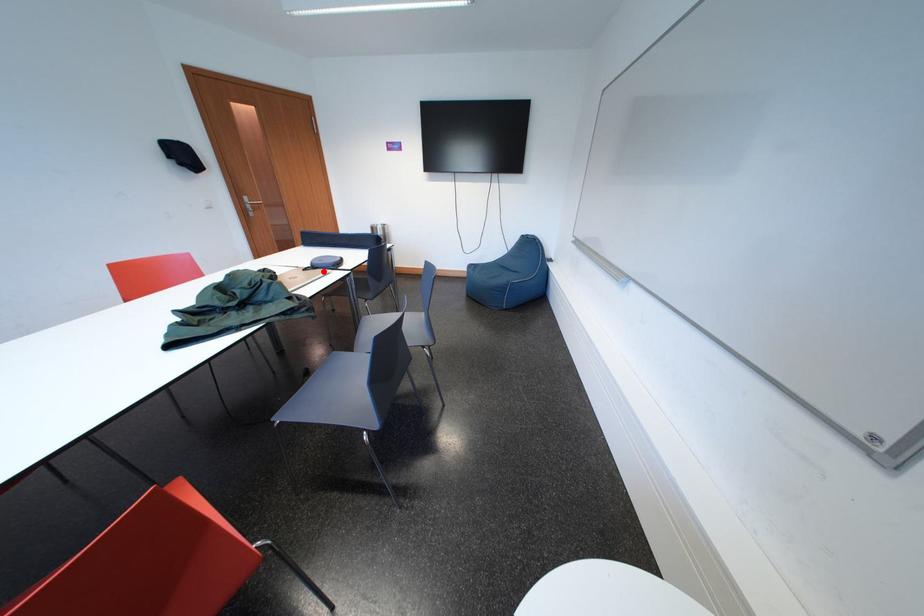
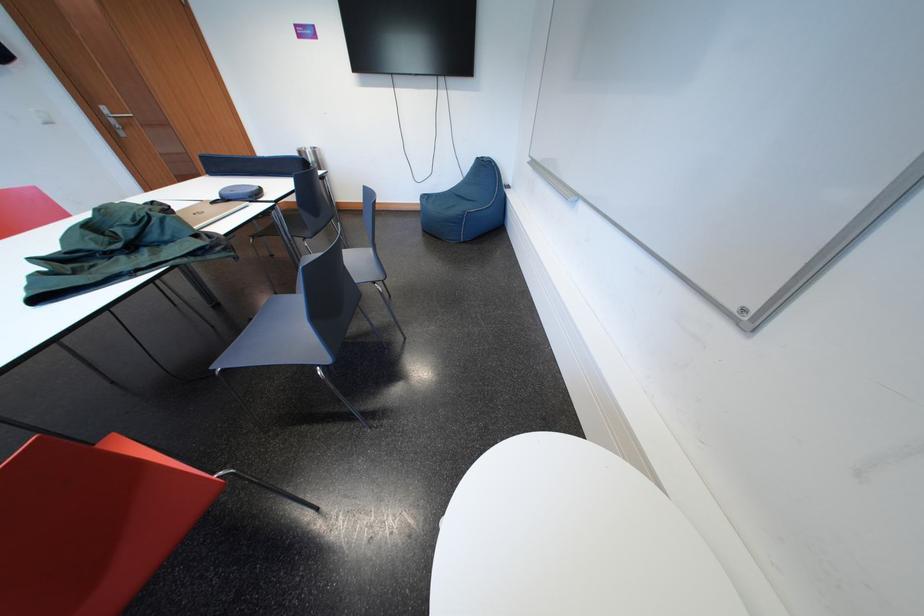
Where in the second image is the point corresponding to the highlighted location from the first image?

(235, 204)